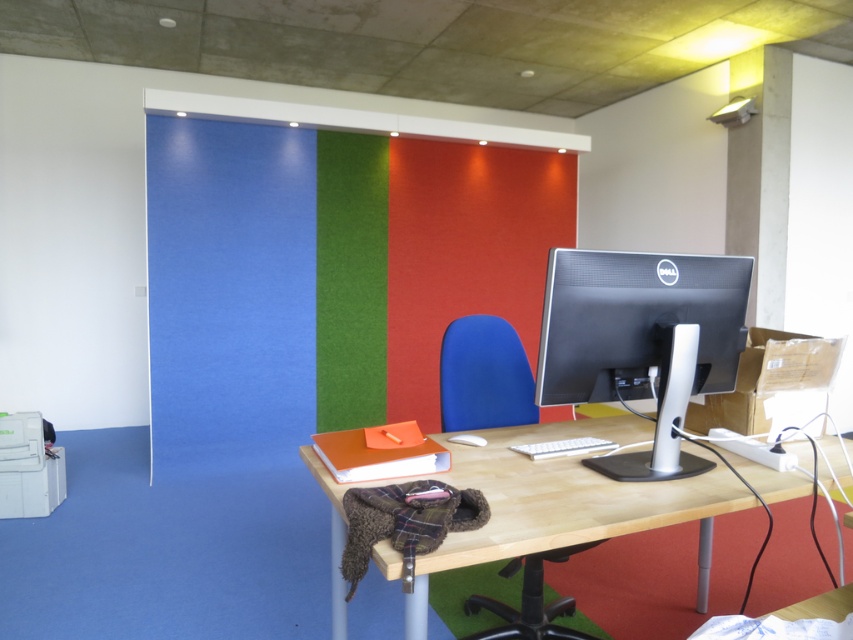
Is point (520, 496) less distant than point (457, 627)?

That is True.

Is the position of light wood/woodendesk at center more distant than that of blue fabric chair at center?

No, light wood/woodendesk at center is in front of blue fabric chair at center.

The height and width of the screenshot is (640, 853). What do you see at coordinates (567, 502) in the screenshot?
I see `light wood/woodendesk at center` at bounding box center [567, 502].

In order to click on light wood/woodendesk at center in this screenshot , I will do `click(567, 502)`.

Is sleek silver monitor at center taller than blue fabric chair at center?

Yes.

Can you confirm if sleek silver monitor at center is positioned above blue fabric chair at center?

Indeed, sleek silver monitor at center is positioned over blue fabric chair at center.

The width and height of the screenshot is (853, 640). What do you see at coordinates (641, 340) in the screenshot? I see `sleek silver monitor at center` at bounding box center [641, 340].

Locate an element on the screen. The image size is (853, 640). sleek silver monitor at center is located at coordinates (641, 340).

Measure the distance between point (404, 600) and camera.

Point (404, 600) and camera are 6.27 feet apart from each other.

Between light wood/woodendesk at center and sleek silver monitor at center, which one is positioned lower?

light wood/woodendesk at center is below.

Identify the location of light wood/woodendesk at center. This screenshot has height=640, width=853. (567, 502).